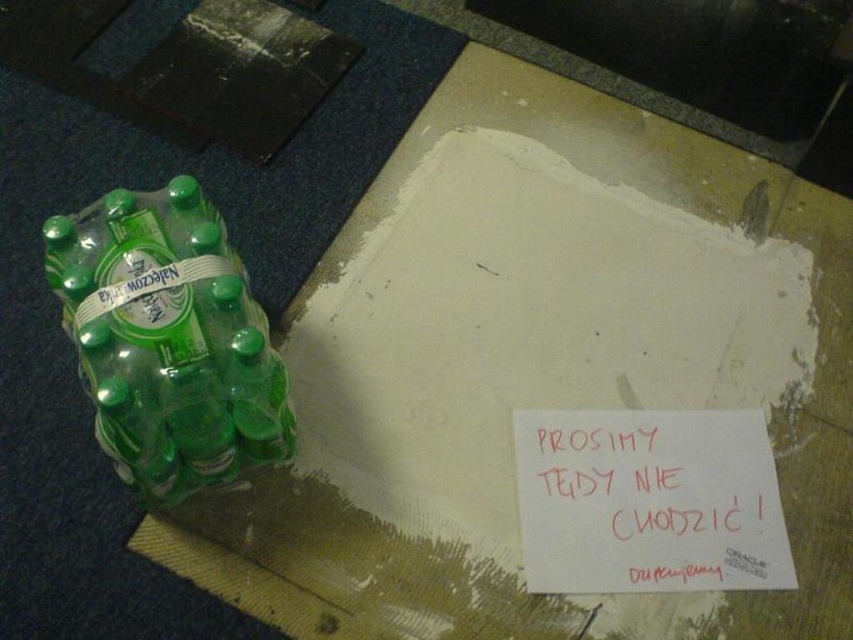
You are a delivery person who needs to place a package on the cardboard with the note. The package is 12 inches wide. Can you safely place it there without moving the green matte plastic bottles at left?

The green matte plastic bottles at left are 36.72 inches away from the camera. Since the package is only 12 inches wide, there is sufficient space between the bottles and the cardboard to place the package safely without moving the bottles.

You are an inventory manager checking the storage area. You see the green matte plastic bottles at left and the green plastic bottle at left. Which one has a greater width?

The green matte plastic bottles at left has a greater width than the green plastic bottle at left.

You are a delivery person holding a package and need to place it on the red paper sign at center. You are currently standing 1.5 meters away from the sign. Can you reach it without moving closer?

The red paper sign at center is 1.12 meters away from the viewer. Since you are 1.5 meters away, you are further than the required distance. Therefore, you cannot reach it without moving closer.